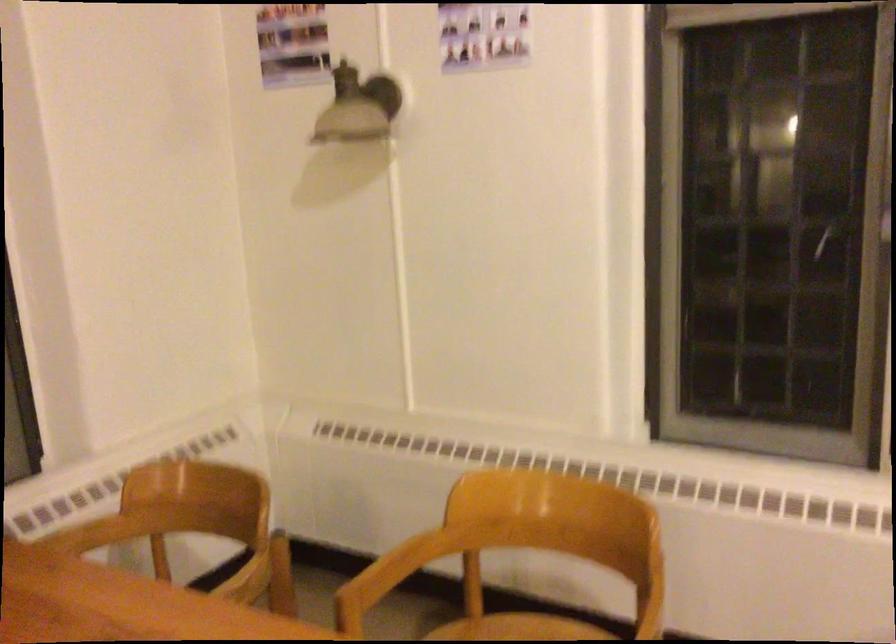
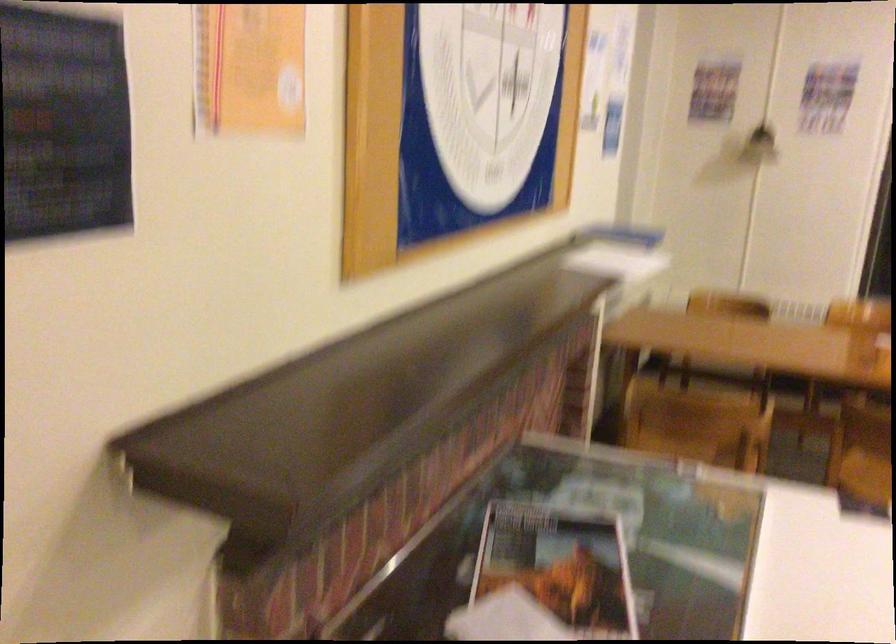
Question: I am providing you with two images of the same scene from different viewpoints. Please identify which objects are invisible in image2.

Choices:
 (A) red lid clip
 (B) small magazine
 (C) chair sitting surface
 (D) stack of papers

Answer: (C)